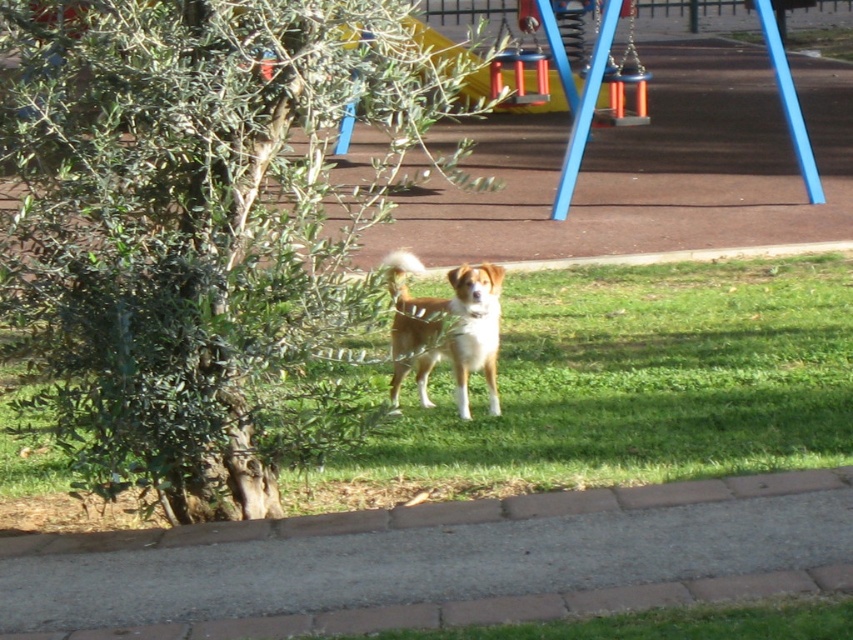
Is green leafy tree at center below green grass at center?

Incorrect, green leafy tree at center is not positioned below green grass at center.

Is point (244, 1) farther from viewer compared to point (815, 392)?

That is False.

Where is `green leafy tree at center`? This screenshot has width=853, height=640. green leafy tree at center is located at coordinates click(x=196, y=230).

This screenshot has width=853, height=640. I want to click on green leafy tree at center, so click(196, 230).

Between green grass at center and brown fur dog at center, which one is positioned higher?

brown fur dog at center is above.

Is green grass at center closer to camera compared to brown fur dog at center?

No, green grass at center is further to the viewer.

Which is in front, point (97, 524) or point (451, 368)?

Positioned in front is point (97, 524).

Identify the location of green grass at center. (625, 387).

Is green leafy tree at center positioned behind brown fur dog at center?

No, green leafy tree at center is in front of brown fur dog at center.

Is point (280, 49) positioned in front of point (392, 264)?

Yes, it is.

Which is in front, point (50, 67) or point (474, 275)?

Point (50, 67)

Find the location of a particular element. green leafy tree at center is located at coordinates (196, 230).